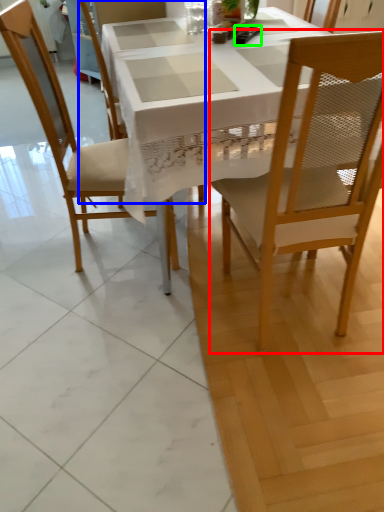
Question: Based on their relative distances, which object is nearer to chair (highlighted by a red box)? Choose from chair (highlighted by a blue box) and remote control (highlighted by a green box).

Choices:
 (A) chair
 (B) remote control

Answer: (B)